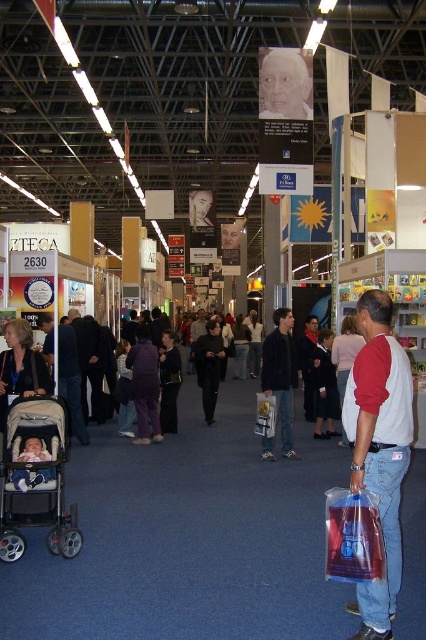
You are a parent attending a trade show and need to move your stroller to the registration desk located at the far end of the hall. The stroller is currently at point [71,380]. Is the stroller positioned to the left or right side of the hall?

The stroller at point [71,380] is positioned to the left side of the hall.

You are navigating through the exhibition hall and want to move from the ZTECA booth to the exit, which is located near the point with coordinates (97, 406). There is an obstacle at point (282, 364). Will you need to go around the obstacle before reaching the exit?

Point (282, 364) is in front of point (97, 406), so you will encounter the obstacle before reaching the exit. You will need to go around the obstacle first.

You are a photographer standing in the exhibition hall. You notice a person wearing a dark blue jacket at center and dark gray pants at center. Which clothing item appears closer to you?

The dark blue jacket at center is closer to the viewer than the dark gray pants at center.